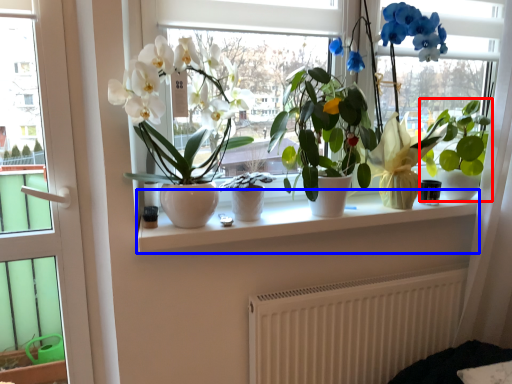
Question: Which object appears closest to the camera in this image, houseplant (highlighted by a red box) or window sill (highlighted by a blue box)?

Choices:
 (A) houseplant
 (B) window sill

Answer: (B)